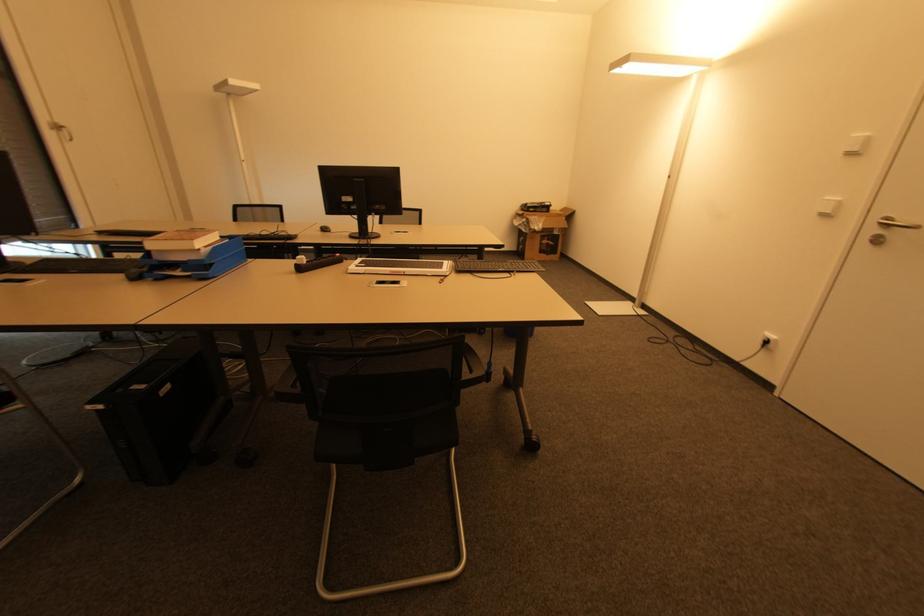
Locate an element on the screen. black chair sitting surface is located at coordinates (387, 392).